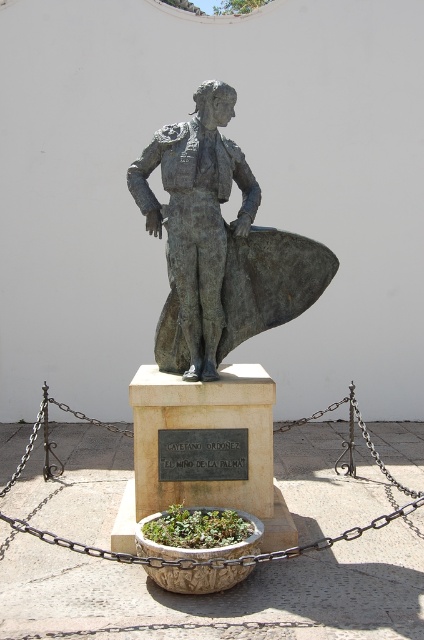
Consider the image. You are a city planner reviewing the layout of a public square. You notice the bronze statue at center and the rusty metal chain at center. According to the provided information, which object is placed above the other?

The bronze statue at center is positioned over the rusty metal chain at center, meaning the statue is above the chain.

You are a photographer taking a picture of the bronze statue of a bullfighter. You notice two points marked on the statue. The first point is at coordinates point [270,296] and the second point is at point [181,564]. Which point is closer to the camera?

Point [181,564] is closer to the camera than point [270,296].